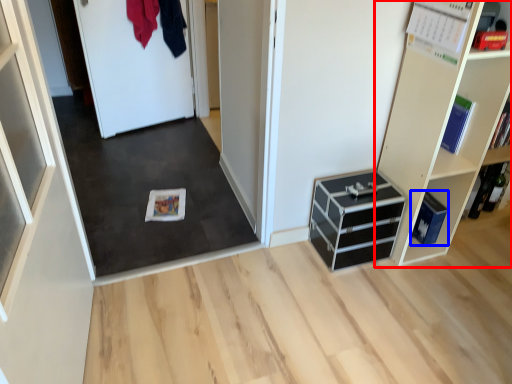
Question: Which object is closer to the camera taking this photo, shelf (highlighted by a red box) or cabinetry (highlighted by a blue box)?

Choices:
 (A) shelf
 (B) cabinetry

Answer: (A)